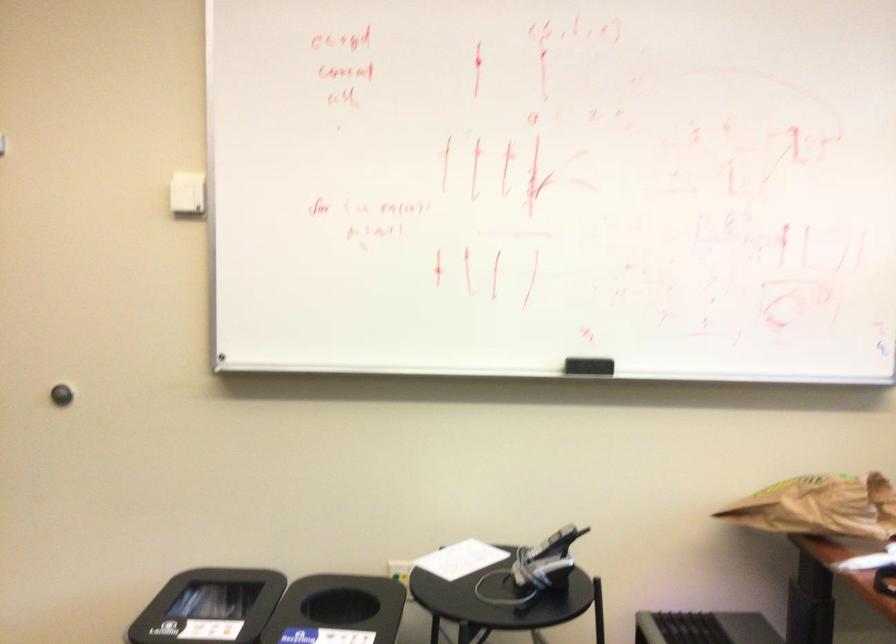
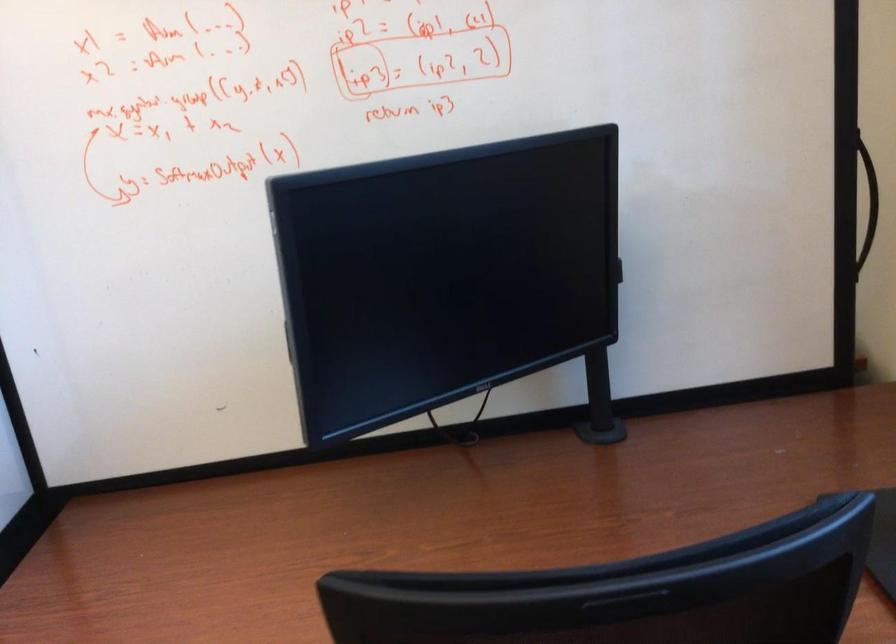
What movement of the cameraman would produce the second image?

The cameraman walked toward right, backward.